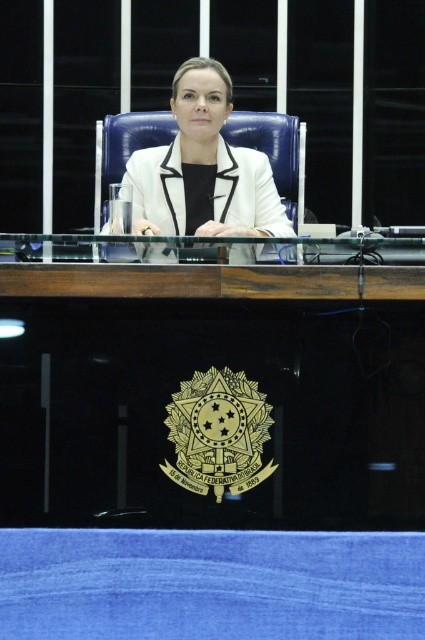
Question: Can you confirm if transparent glass table at center is positioned above white glossy blazer at center?

Choices:
 (A) no
 (B) yes

Answer: (A)

Question: Which of the following is the closest to the observer?

Choices:
 (A) (200, 188)
 (B) (249, 417)

Answer: (B)

Question: Where is transparent glass table at center located in relation to white glossy blazer at center in the image?

Choices:
 (A) right
 (B) left

Answer: (A)

Question: Is transparent glass table at center below white glossy blazer at center?

Choices:
 (A) no
 (B) yes

Answer: (B)